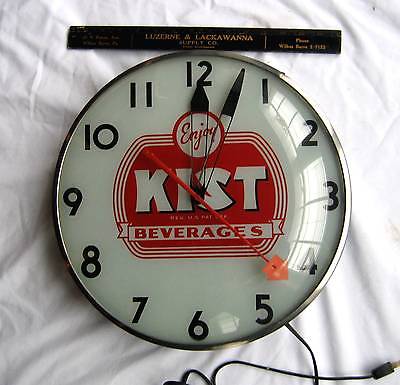
Identify the location of sheet. The image size is (400, 385). (44, 77), (363, 303), (368, 110), (45, 313).